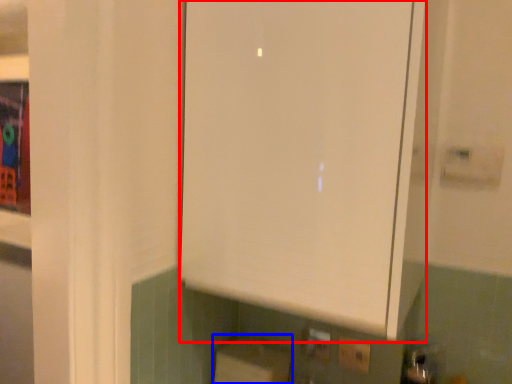
Question: Which object appears closest to the camera in this image, cabinetry (highlighted by a red box) or cardboard box (highlighted by a blue box)?

Choices:
 (A) cabinetry
 (B) cardboard box

Answer: (A)